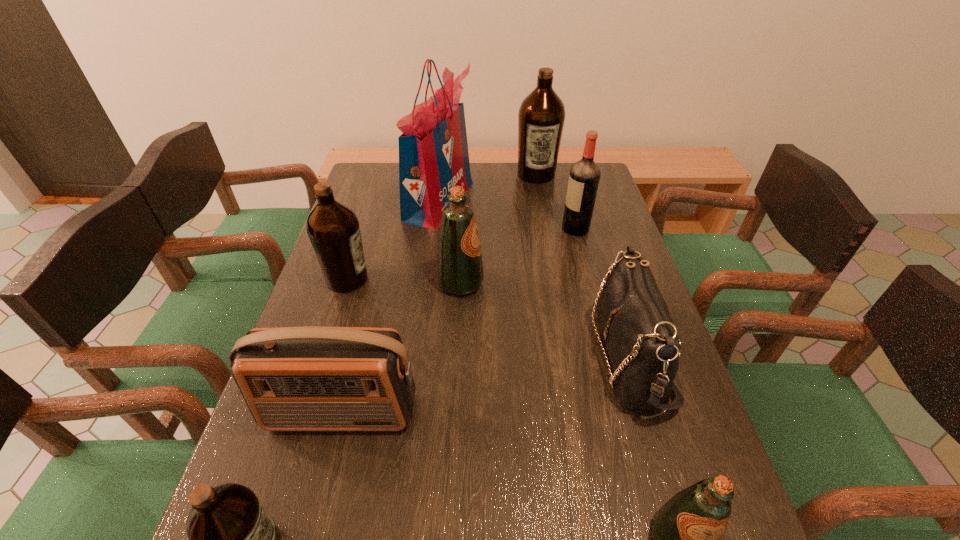
This screenshot has width=960, height=540. Find the location of `vacant region located at the front of the handbag with chain and zipper`. vacant region located at the front of the handbag with chain and zipper is located at coordinates (523, 355).

What are the coordinates of `grocery bag that is at the far edge` in the screenshot? It's located at (433, 151).

In order to click on olive oil at the far edge in this screenshot , I will do `click(541, 116)`.

Where is `olive oil present at the left edge`? olive oil present at the left edge is located at coordinates (333, 228).

This screenshot has height=540, width=960. Identify the location of radio receiver that is at the left edge. (311, 378).

Locate an element on the screen. Image resolution: width=960 pixels, height=540 pixels. olive oil positioned at the right edge is located at coordinates (541, 116).

At what (x,y) coordinates should I click in order to perform the action: click on liquor that is at the right edge. Please return your answer as a coordinate pair (x, y). The height and width of the screenshot is (540, 960). Looking at the image, I should click on (584, 177).

Find the location of a particular element. handbag present at the right edge is located at coordinates (642, 341).

I want to click on object located in the far right corner section of the desktop, so click(x=541, y=116).

Where is `free location at the far edge of the desktop`? This screenshot has height=540, width=960. free location at the far edge of the desktop is located at coordinates (520, 185).